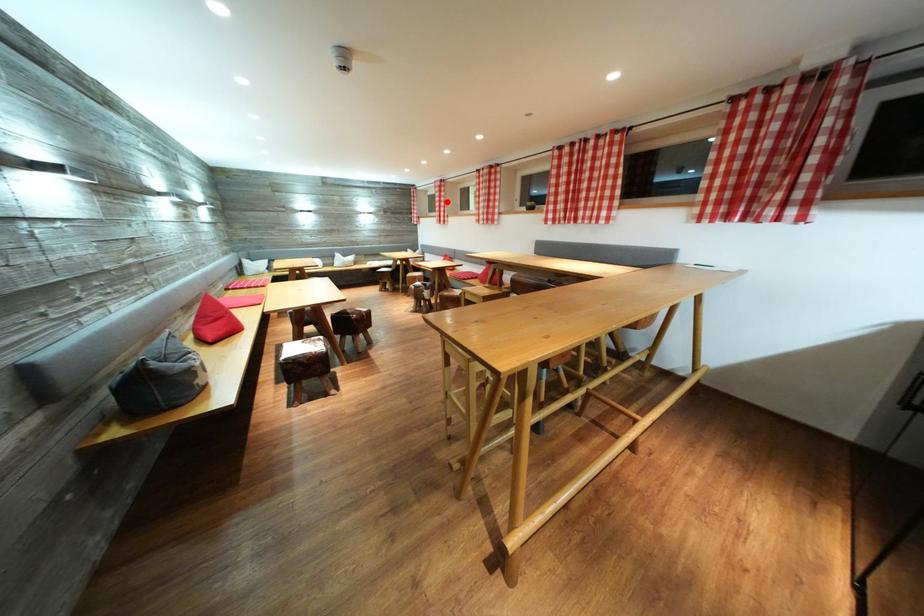
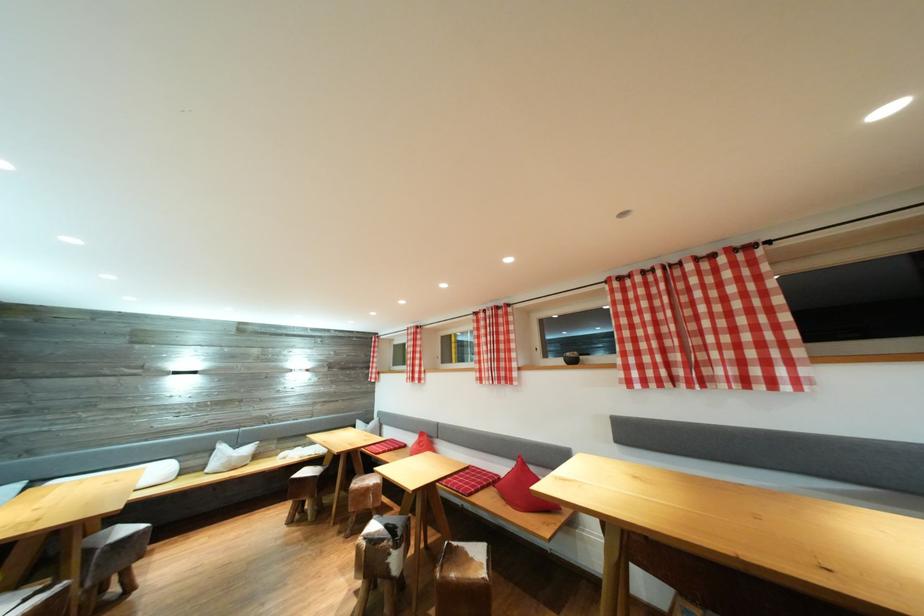
Question: I am providing you with two images of the same scene from different viewpoints. A red point is shown in image1. For the corresponding object point in image2, is it positioned nearer or farther from the camera?

Choices:
 (A) Nearer
 (B) Farther

Answer: (B)